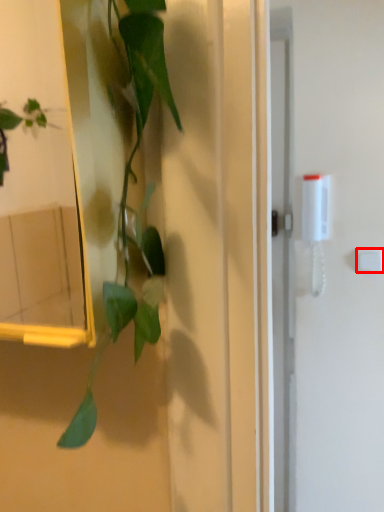
Question: From the image's perspective, what is the correct spatial relationship of light switch (annotated by the red box) in relation to houseplant?

Choices:
 (A) below
 (B) above

Answer: (A)